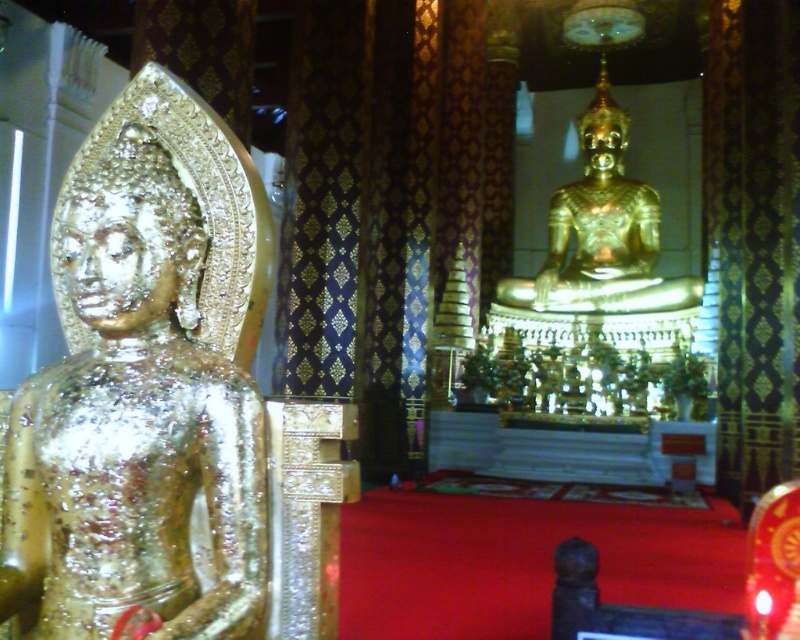
Question: Where is gold shiny statue at left located in relation to gold polished statue at center in the image?

Choices:
 (A) right
 (B) left

Answer: (B)

Question: Does gold shiny statue at left have a lesser width compared to gold polished statue at center?

Choices:
 (A) no
 (B) yes

Answer: (B)

Question: Which object is farther from the camera taking this photo?

Choices:
 (A) gold polished statue at center
 (B) gold shiny statue at left

Answer: (A)

Question: Does gold shiny statue at left have a larger size compared to gold polished statue at center?

Choices:
 (A) yes
 (B) no

Answer: (B)

Question: Among these objects, which one is farthest from the camera?

Choices:
 (A) gold shiny statue at left
 (B) gold polished statue at center

Answer: (B)